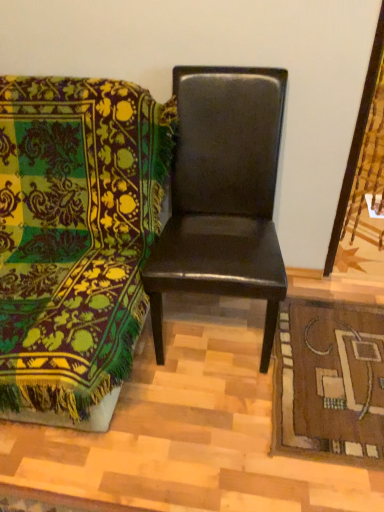
Question: From a real-world perspective, is brown woven mat at lower right above or below matte black chair at center, the second chair from the right?

Choices:
 (A) below
 (B) above

Answer: (A)

Question: Does point (312, 309) appear closer or farther from the camera than point (54, 345)?

Choices:
 (A) closer
 (B) farther

Answer: (B)

Question: Which is farther from the matte black chair at center, the second chair from the right?

Choices:
 (A) glossy black chair at center, the first chair positioned from the right
 (B) brown woven mat at lower right

Answer: (B)

Question: Which object is positioned closest to the matte black chair at center, the second chair from the right?

Choices:
 (A) brown woven mat at lower right
 (B) glossy black chair at center, which is the second chair in left-to-right order

Answer: (B)